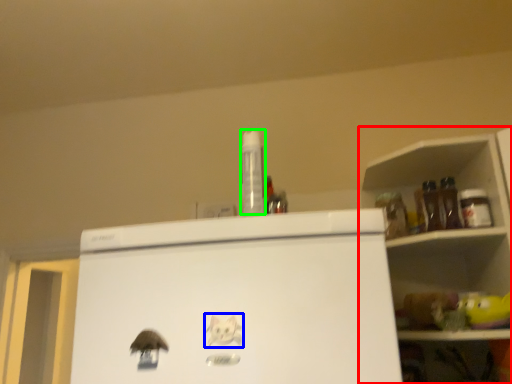
Question: Considering the real-world distances, which object is farthest from shelf (highlighted by a red box)? animal (highlighted by a blue box) or bottle (highlighted by a green box)?

Choices:
 (A) animal
 (B) bottle

Answer: (A)